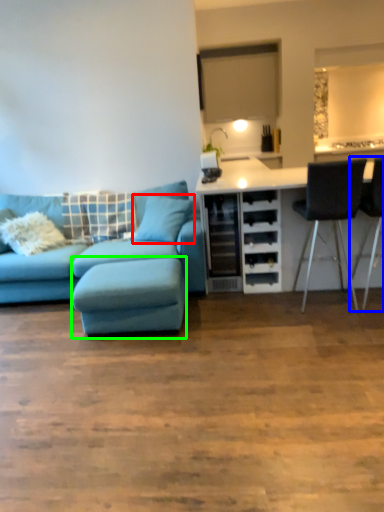
Question: Based on their relative distances, which object is farther from pillow (highlighted by a red box)? Choose from chair (highlighted by a blue box) and footrest (highlighted by a green box).

Choices:
 (A) chair
 (B) footrest

Answer: (A)